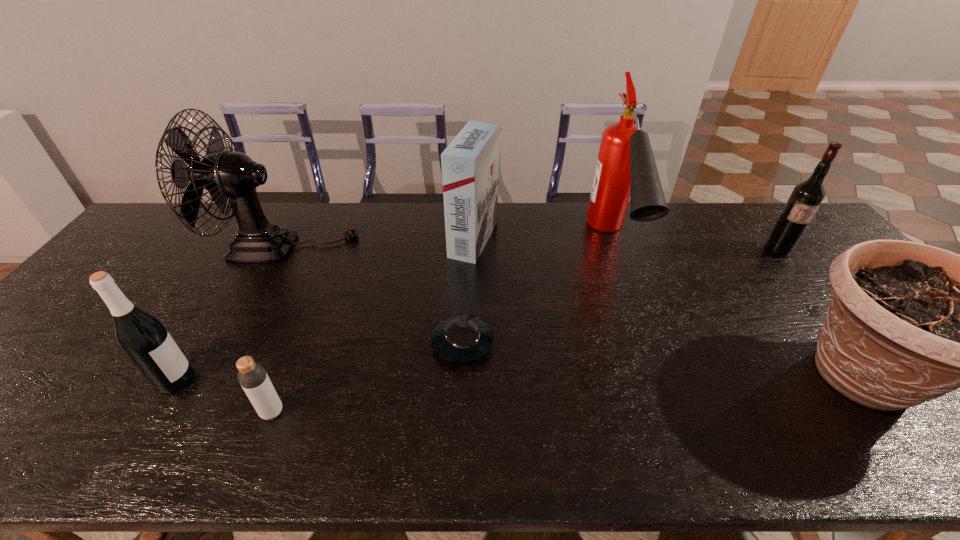
At what (x,y) coordinates should I click in order to perform the action: click on vacant area that lies between the seventh tallest object and the shortest object. Please return your answer as a coordinate pair (x, y). Image resolution: width=960 pixels, height=540 pixels. Looking at the image, I should click on (368, 377).

I want to click on free space between the cigarette case and the third object from right to left, so click(542, 241).

Where is `object identified as the sixth closest to the flowerpot`? object identified as the sixth closest to the flowerpot is located at coordinates (252, 376).

The height and width of the screenshot is (540, 960). Identify the location of the sixth closest object to the cigarette case. (907, 323).

This screenshot has width=960, height=540. I want to click on free space that satisfies the following two spatial constraints: 1. on the front and back of the farther wine bottle; 2. on the label of the left wine bottle, so click(880, 380).

I want to click on vacant space that satisfies the following two spatial constraints: 1. at the nozzle of the fire extinguisher; 2. in front of the fan, indicating the direction of air flow, so click(x=613, y=247).

At what (x,y) coordinates should I click in order to perform the action: click on free location that satisfies the following two spatial constraints: 1. at the nozzle of the sixth object from left to right; 2. in front of the fan, indicating the direction of air flow. Please return your answer as a coordinate pair (x, y). The height and width of the screenshot is (540, 960). Looking at the image, I should click on (613, 247).